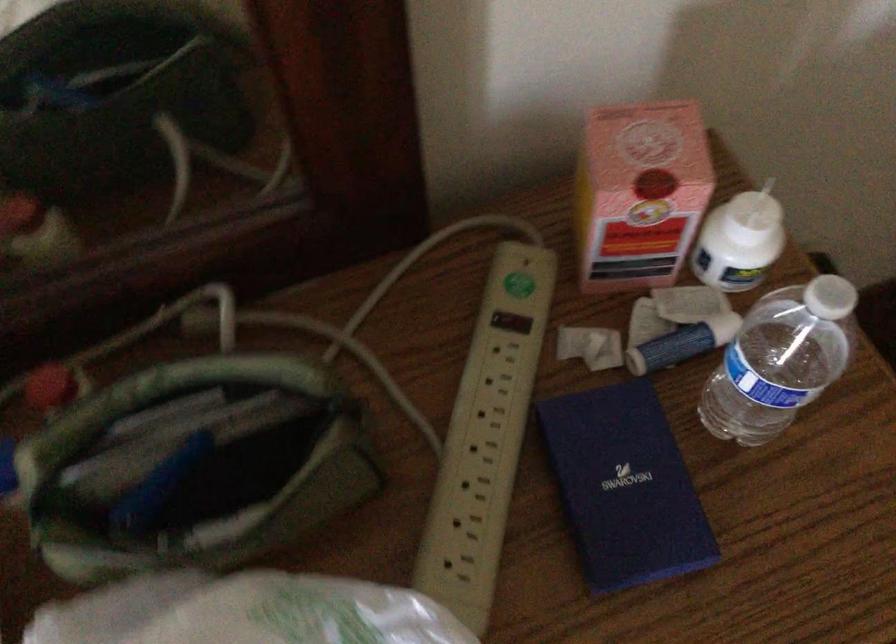
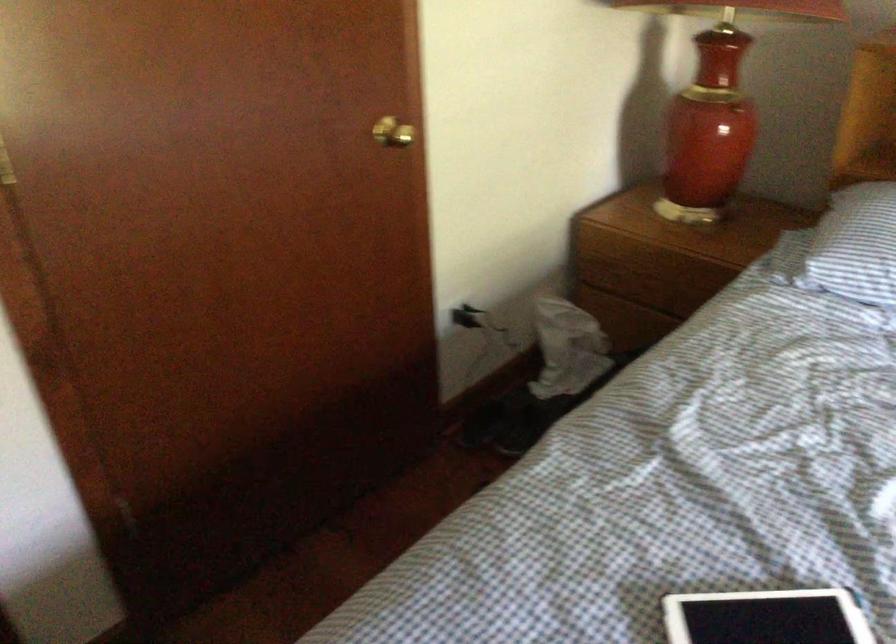
The images are taken continuously from a first-person perspective. In which direction is your viewpoint rotating?

The rotation direction of the camera is right-down.